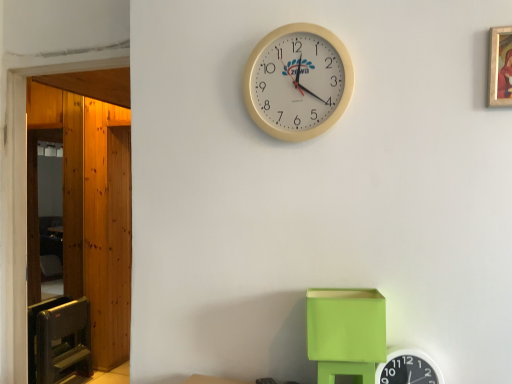
Question: Should I look upward or downward to see white plastic wall clock at upper center, the 1th wall clock when ordered from right to left?

Choices:
 (A) down
 (B) up

Answer: (A)

Question: Considering the relative sizes of white plastic wall clock at upper center, the first wall clock ordered from the bottom, and beige plastic wall clock at upper center, which is the second wall clock in right-to-left order, in the image provided, is white plastic wall clock at upper center, the first wall clock ordered from the bottom, taller than beige plastic wall clock at upper center, which is the second wall clock in right-to-left order,?

Choices:
 (A) no
 (B) yes

Answer: (A)

Question: Does white plastic wall clock at upper center, acting as the second wall clock starting from the top, come in front of beige plastic wall clock at upper center, which is the 2th wall clock in bottom-to-top order?

Choices:
 (A) no
 (B) yes

Answer: (B)

Question: From a real-world perspective, is white plastic wall clock at upper center, acting as the second wall clock starting from the top, under beige plastic wall clock at upper center, which is the second wall clock in right-to-left order?

Choices:
 (A) no
 (B) yes

Answer: (B)

Question: Could you tell me if white plastic wall clock at upper center, the 1th wall clock when ordered from right to left, is turned towards beige plastic wall clock at upper center, which is the second wall clock in right-to-left order?

Choices:
 (A) no
 (B) yes

Answer: (A)

Question: From the image's perspective, is white plastic wall clock at upper center, the 1th wall clock when ordered from right to left, located beneath beige plastic wall clock at upper center, placed as the first wall clock when sorted from top to bottom?

Choices:
 (A) no
 (B) yes

Answer: (B)

Question: Are white plastic wall clock at upper center, acting as the second wall clock starting from the top, and beige plastic wall clock at upper center, placed as the first wall clock when sorted from top to bottom, making contact?

Choices:
 (A) no
 (B) yes

Answer: (A)

Question: Is the position of gold-framed painting at upper right more distant than that of white plastic wall clock at upper center, the 1th wall clock when ordered from right to left?

Choices:
 (A) yes
 (B) no

Answer: (B)

Question: Can you confirm if gold-framed painting at upper right is positioned to the right of white plastic wall clock at upper center, which is the 2th wall clock in left-to-right order?

Choices:
 (A) yes
 (B) no

Answer: (A)

Question: Is gold-framed painting at upper right positioned in front of white plastic wall clock at upper center, the first wall clock ordered from the bottom?

Choices:
 (A) yes
 (B) no

Answer: (A)

Question: Is gold-framed painting at upper right bigger than white plastic wall clock at upper center, acting as the second wall clock starting from the top?

Choices:
 (A) yes
 (B) no

Answer: (B)

Question: Is gold-framed painting at upper right shorter than white plastic wall clock at upper center, the 1th wall clock when ordered from right to left?

Choices:
 (A) yes
 (B) no

Answer: (B)

Question: Does gold-framed painting at upper right appear on the left side of white plastic wall clock at upper center, which is the 2th wall clock in left-to-right order?

Choices:
 (A) yes
 (B) no

Answer: (B)

Question: Is beige plastic wall clock at upper center, placed as the first wall clock when sorted from top to bottom, to the left of wooden door at left from the viewer's perspective?

Choices:
 (A) no
 (B) yes

Answer: (A)